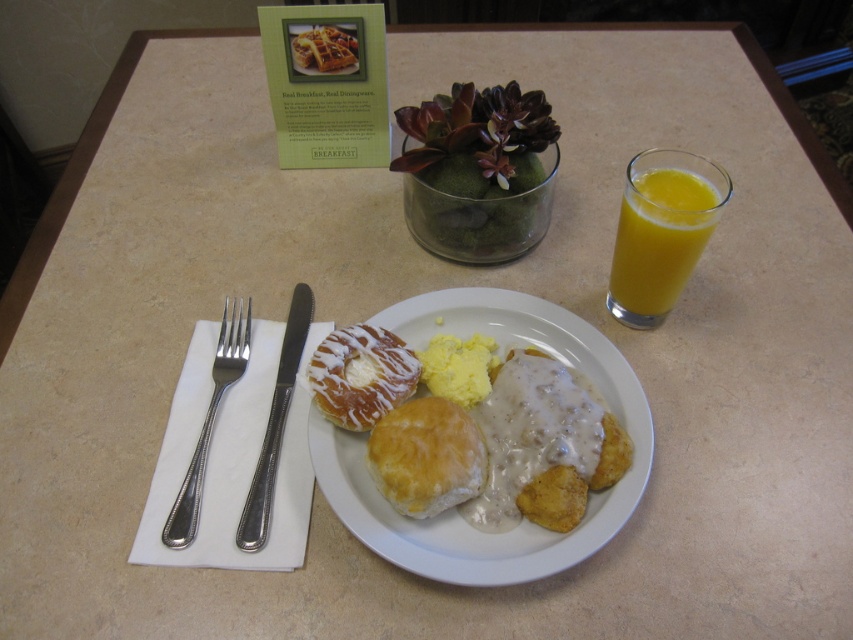
In the scene shown: You are a robot with a camera that can detect objects in 2D coordinates. You need to pick up the silver metallic fork at left. What are the coordinates where you should move your robotic arm to retrieve it?

The coordinates for the silver metallic fork at left are at point (209, 420).

You are a person with a 12 inch long arm. You want to reach the translucent glass of orange juice at right from your current position. Can you reach it?

The distance between the translucent glass of orange juice at right and the viewer is 16.57 inches. Since your arm is only 12 inches long, you cannot reach the glass.

You are sitting at the breakfast table and want to grab the closest item between the golden glazed biscuit at center and the glazed doughnut at center. Which one should you reach for?

The golden glazed biscuit at center is closer to the viewer than the glazed doughnut at center, so you should reach for the golden glazed biscuit at center.